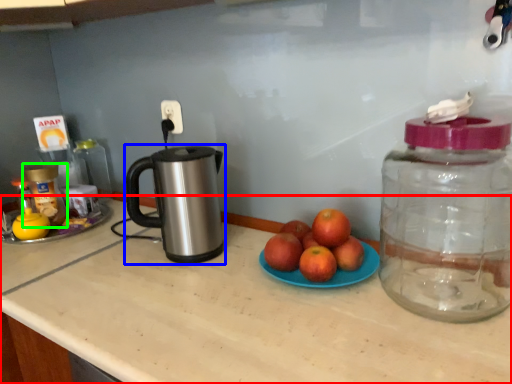
Question: Estimate the real-world distances between objects in this image. Which object is farther from countertop (highlighted by a red box), kettle (highlighted by a blue box) or bottle (highlighted by a green box)?

Choices:
 (A) kettle
 (B) bottle

Answer: (B)